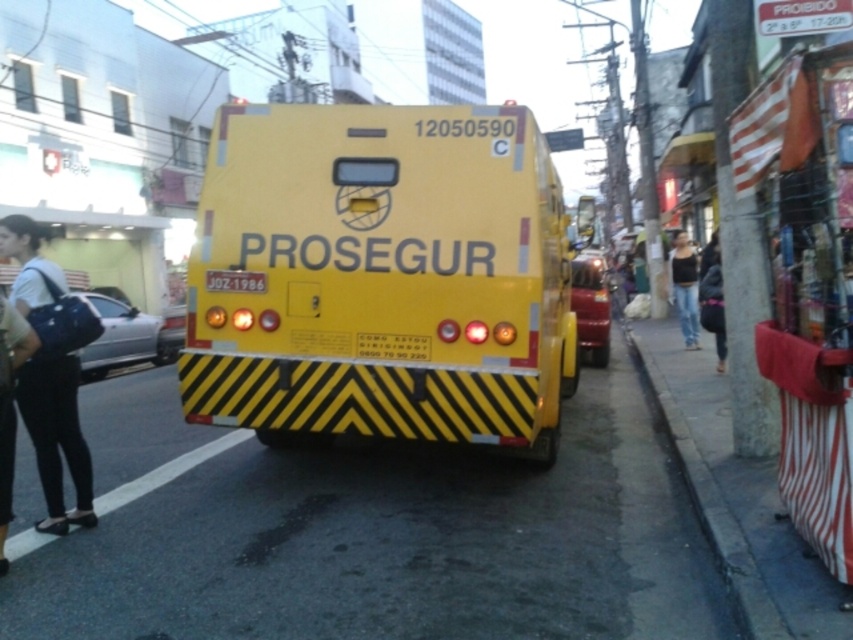
Question: Which of the following is the farthest from the observer?

Choices:
 (A) yellow matte truck at center
 (B) yellow reflective license plate at center

Answer: (B)

Question: Is yellow matte truck at center positioned before yellow reflective license plate at center?

Choices:
 (A) yes
 (B) no

Answer: (A)

Question: Which point is farther to the camera?

Choices:
 (A) (207, 168)
 (B) (380, 355)

Answer: (A)

Question: Can you confirm if yellow matte truck at center is smaller than yellow reflective license plate at center?

Choices:
 (A) yes
 (B) no

Answer: (B)

Question: Is yellow matte truck at center above yellow reflective license plate at center?

Choices:
 (A) yes
 (B) no

Answer: (A)